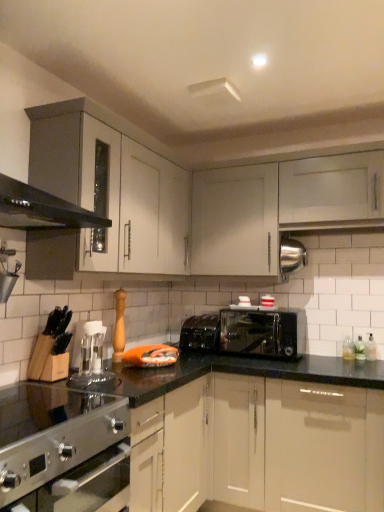
Question: Is satin silver gas stove at lower left at the left side of transparent plastic coffee machine at center?

Choices:
 (A) yes
 (B) no

Answer: (A)

Question: Considering the relative sizes of satin silver gas stove at lower left and transparent plastic coffee machine at center in the image provided, is satin silver gas stove at lower left smaller than transparent plastic coffee machine at center?

Choices:
 (A) no
 (B) yes

Answer: (A)

Question: Is satin silver gas stove at lower left not within transparent plastic coffee machine at center?

Choices:
 (A) no
 (B) yes

Answer: (B)

Question: From the image's perspective, is satin silver gas stove at lower left located above transparent plastic coffee machine at center?

Choices:
 (A) no
 (B) yes

Answer: (A)

Question: Is satin silver gas stove at lower left to the right of transparent plastic coffee machine at center from the viewer's perspective?

Choices:
 (A) no
 (B) yes

Answer: (A)

Question: Based on their sizes in the image, would you say black plastic toaster at center is bigger or smaller than clear glass bottle at lower right?

Choices:
 (A) big
 (B) small

Answer: (A)

Question: Is black plastic toaster at center inside the boundaries of clear glass bottle at lower right, or outside?

Choices:
 (A) outside
 (B) inside

Answer: (A)

Question: From a real-world perspective, is black plastic toaster at center physically located above or below clear glass bottle at lower right?

Choices:
 (A) below
 (B) above

Answer: (B)

Question: Considering the positions of black plastic toaster at center and clear glass bottle at lower right in the image, is black plastic toaster at center taller or shorter than clear glass bottle at lower right?

Choices:
 (A) tall
 (B) short

Answer: (A)

Question: Does point (87, 468) appear closer or farther from the camera than point (6, 430)?

Choices:
 (A) closer
 (B) farther

Answer: (A)

Question: Is satin silver oven at lower left in front of or behind satin silver gas stove at lower left in the image?

Choices:
 (A) front
 (B) behind

Answer: (B)

Question: From the image's perspective, is satin silver oven at lower left located above or below satin silver gas stove at lower left?

Choices:
 (A) above
 (B) below

Answer: (B)

Question: Is satin silver oven at lower left wider or thinner than satin silver gas stove at lower left?

Choices:
 (A) thin
 (B) wide

Answer: (A)

Question: Visually, is white glossy cabinet at upper right, arranged as the first cabinetry when viewed from the right, positioned to the left or to the right of black plastic toaster at center?

Choices:
 (A) left
 (B) right

Answer: (B)

Question: Is white glossy cabinet at upper right, arranged as the first cabinetry when viewed from the right, wider or thinner than black plastic toaster at center?

Choices:
 (A) thin
 (B) wide

Answer: (A)